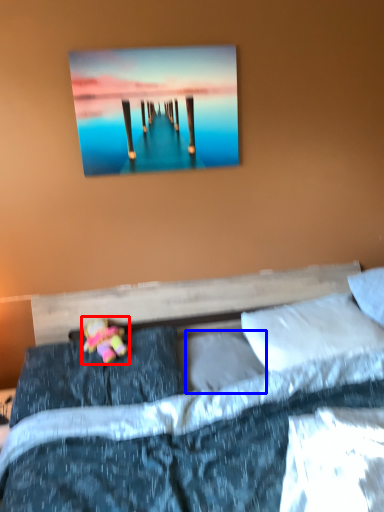
Question: Which of the following is the farthest to the observer, doll (highlighted by a red box) or pillow (highlighted by a blue box)?

Choices:
 (A) doll
 (B) pillow

Answer: (B)